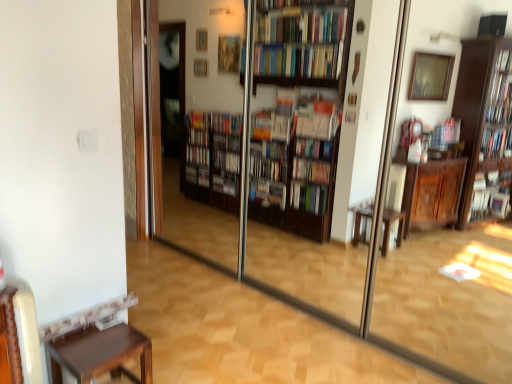
Question: Is brown wood stool at lower left in front of or behind transparent glass screen door at center in the image?

Choices:
 (A) behind
 (B) front

Answer: (A)

Question: Based on their positions, is brown wood stool at lower left located to the left or right of transparent glass screen door at center?

Choices:
 (A) right
 (B) left

Answer: (B)

Question: From their relative heights in the image, would you say brown wood stool at lower left is taller or shorter than transparent glass screen door at center?

Choices:
 (A) short
 (B) tall

Answer: (A)

Question: In terms of size, does transparent glass screen door at center appear bigger or smaller than brown wood stool at lower left?

Choices:
 (A) small
 (B) big

Answer: (B)

Question: Is point (230, 216) positioned closer to the camera than point (100, 332)?

Choices:
 (A) closer
 (B) farther

Answer: (B)

Question: In the image, is transparent glass screen door at center positioned in front of or behind brown wood stool at lower left?

Choices:
 (A) behind
 (B) front

Answer: (B)

Question: From the image's perspective, is transparent glass screen door at center above or below brown wood stool at lower left?

Choices:
 (A) above
 (B) below

Answer: (A)